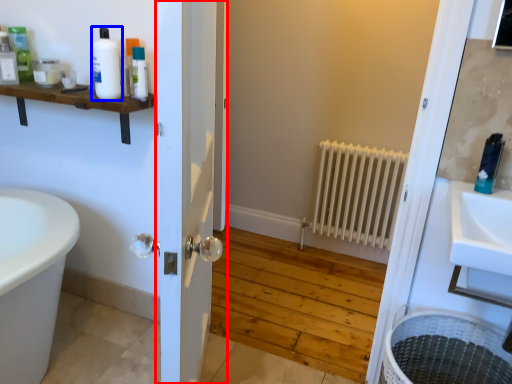
Question: Which point is closer to the camera, door (highlighted by a red box) or toiletry (highlighted by a blue box)?

Choices:
 (A) door
 (B) toiletry

Answer: (A)